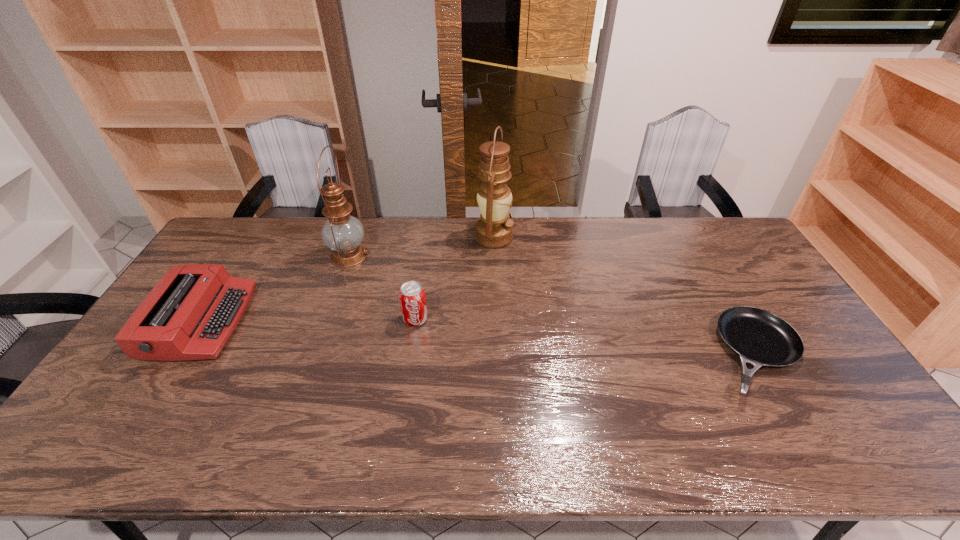
Where is `free space located on the left of the third object from right to left`? The height and width of the screenshot is (540, 960). free space located on the left of the third object from right to left is located at coordinates (323, 319).

Where is `free space located 0.380m on the typing side of the typewriter`? free space located 0.380m on the typing side of the typewriter is located at coordinates click(x=371, y=322).

Where is `vacant space situated 0.230m on the back of the shortest object`? vacant space situated 0.230m on the back of the shortest object is located at coordinates 704,264.

Find the location of a particular element. The image size is (960, 540). object present at the left edge is located at coordinates (191, 313).

In order to click on object present at the right edge in this screenshot , I will do `click(760, 338)`.

Locate an element on the screen. The height and width of the screenshot is (540, 960). vacant space at the far edge of the desktop is located at coordinates (398, 255).

I want to click on vacant space at the near edge of the desktop, so click(x=595, y=451).

In the image, there is a desktop. Identify the location of vacant space at the right edge. (783, 307).

This screenshot has width=960, height=540. In the image, there is a desktop. In order to click on vacant space at the far left corner in this screenshot , I will do `click(222, 235)`.

This screenshot has width=960, height=540. In the image, there is a desktop. Identify the location of free space at the near left corner. (142, 427).